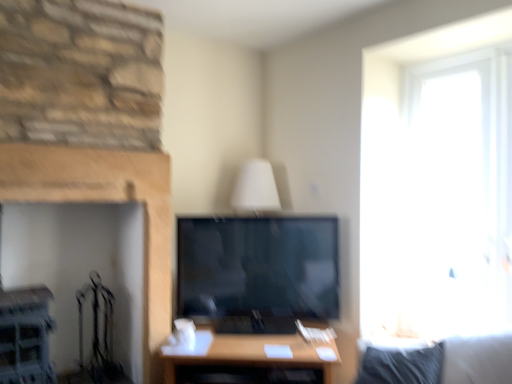
Locate an element on the screen. The image size is (512, 384). blank space situated above smooth stone fireplace at left (from a real-world perspective) is located at coordinates (84, 149).